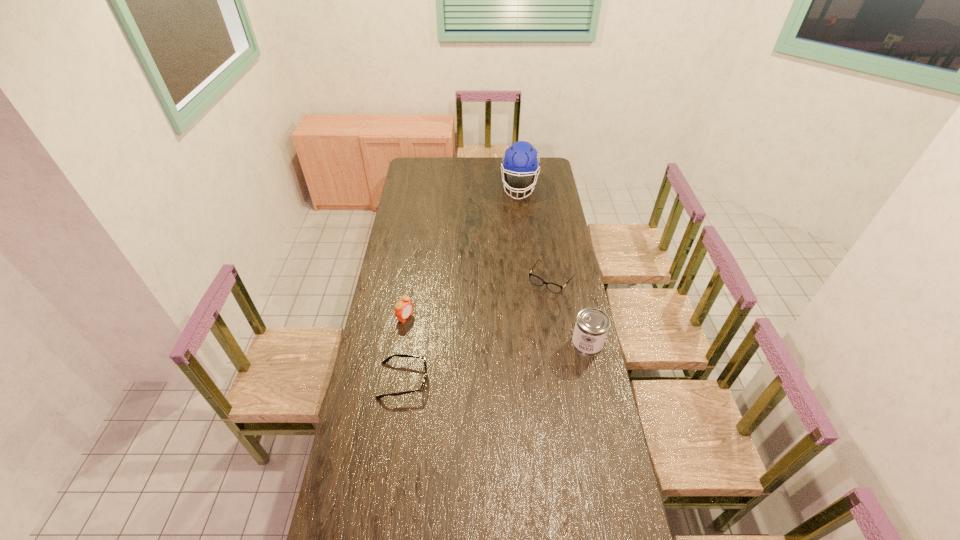
The image size is (960, 540). Identify the location of the left spectacles. (386, 360).

You are a GUI agent. You are given a task and a screenshot of the screen. Output one action in this format:
    pyautogui.click(x=<x>, y=<y>)
    Task: Click on the nearest object
    
    Given the screenshot: What is the action you would take?
    pyautogui.click(x=386, y=360)

Locate an element on the screen. the fourth shortest object is located at coordinates (591, 327).

The height and width of the screenshot is (540, 960). I want to click on the second nearest object, so click(x=591, y=327).

Image resolution: width=960 pixels, height=540 pixels. I want to click on the second farthest object, so click(x=536, y=280).

Locate an element on the screen. the farther spectacles is located at coordinates (536, 280).

The image size is (960, 540). I want to click on the third nearest object, so click(x=403, y=308).

This screenshot has width=960, height=540. Identify the location of alarm clock. (403, 308).

Where is `the tallest object`? the tallest object is located at coordinates coord(521,159).

Where is `football helmet`? Image resolution: width=960 pixels, height=540 pixels. football helmet is located at coordinates (521, 159).